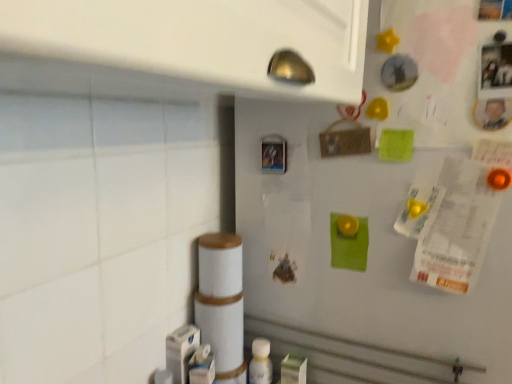
Question: From the image's perspective, relative to white matte refrigerator at upper right, is metallic plastic button at center above or below?

Choices:
 (A) above
 (B) below

Answer: (A)

Question: In the image, is metallic plastic button at center on the left side or the right side of white matte refrigerator at upper right?

Choices:
 (A) right
 (B) left

Answer: (B)

Question: Considering the real-world distances, which object is farthest from the metallic plastic button at center?

Choices:
 (A) white plastic bottle at lower center
 (B) white matte refrigerator at upper right

Answer: (A)

Question: Estimate the real-world distances between objects in this image. Which object is farther from the white plastic bottle at lower center?

Choices:
 (A) metallic plastic button at center
 (B) white matte refrigerator at upper right

Answer: (A)